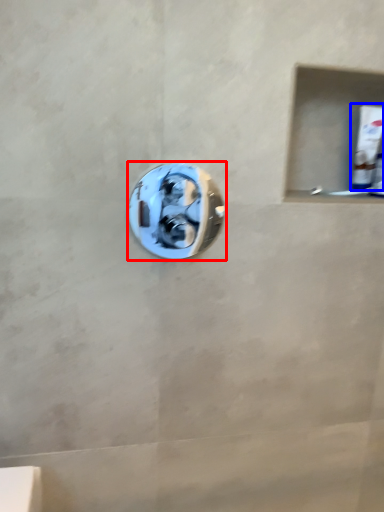
Question: Among these objects, which one is nearest to the camera, door handle (highlighted by a red box) or toothpaste (highlighted by a blue box)?

Choices:
 (A) door handle
 (B) toothpaste

Answer: (A)